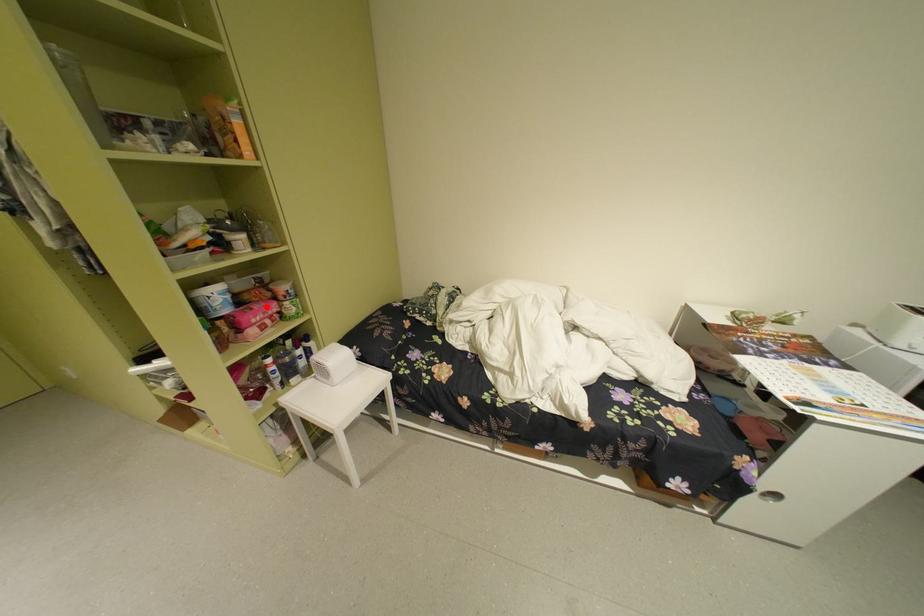
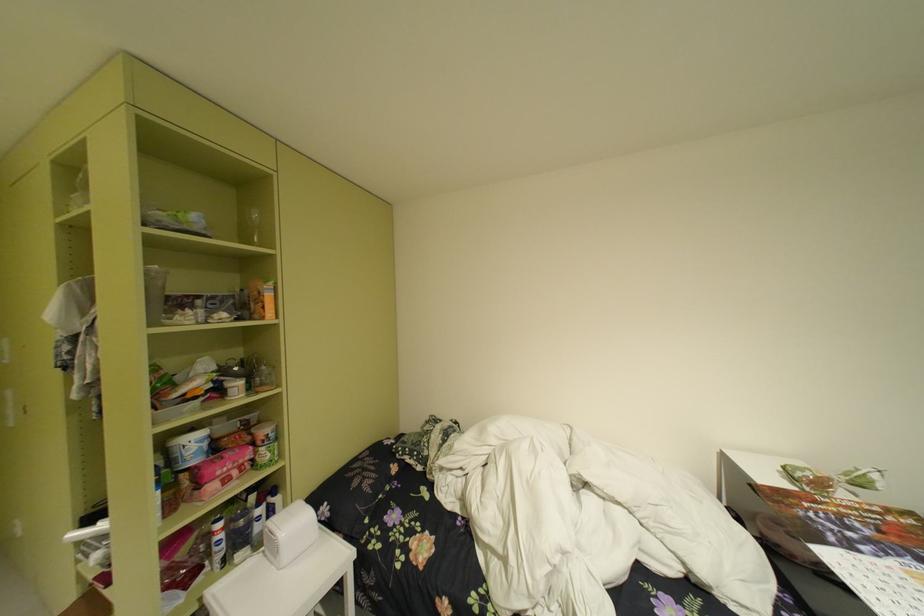
The point at the highlighted location is marked in the first image. Where is the corresponding point in the second image?

(238, 455)